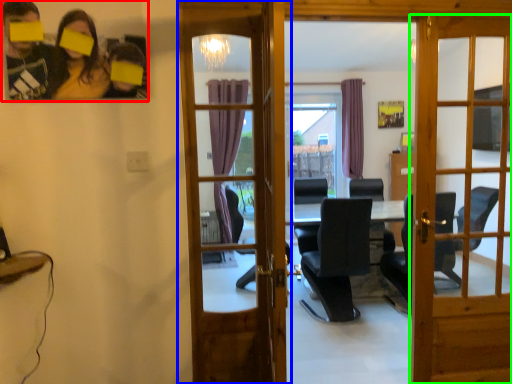
Question: Estimate the real-world distances between objects in this image. Which object is farther from couple (highlighted by a red box), door (highlighted by a blue box) or door (highlighted by a green box)?

Choices:
 (A) door
 (B) door

Answer: (A)